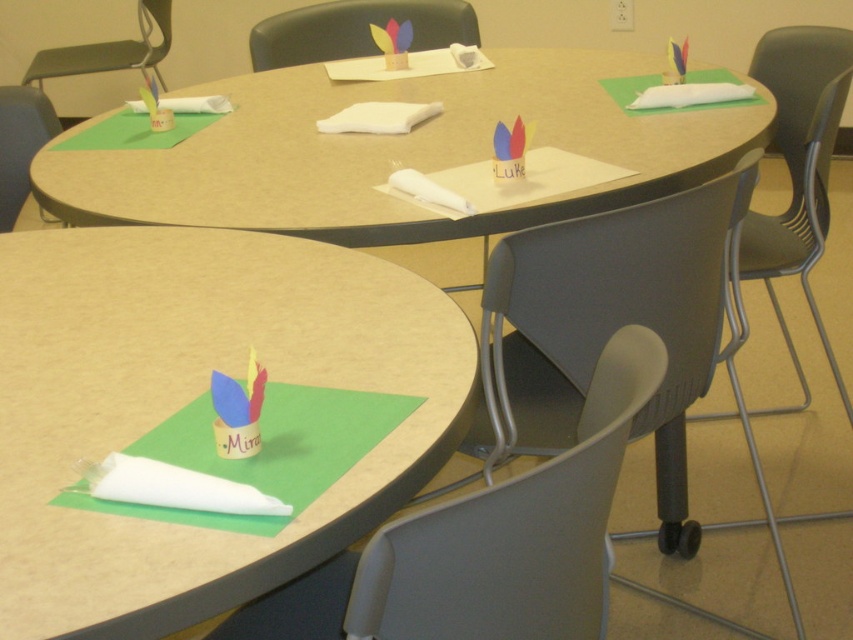
You are organizing a classroom activity and need to move the matte blue paper cup at lower left to the other side of the room. To do this, you must first determine if there is enough space between the metallic gray chair at upper left and the nearest wall. Can you confirm if the space between them allows for moving the cup without dislodging the chair?

The metallic gray chair at upper left is above the matte blue paper cup at lower left, but the distance between the chair and the wall is not specified in the provided information. Therefore, it is unclear if there is sufficient space to move the cup without affecting the chair.